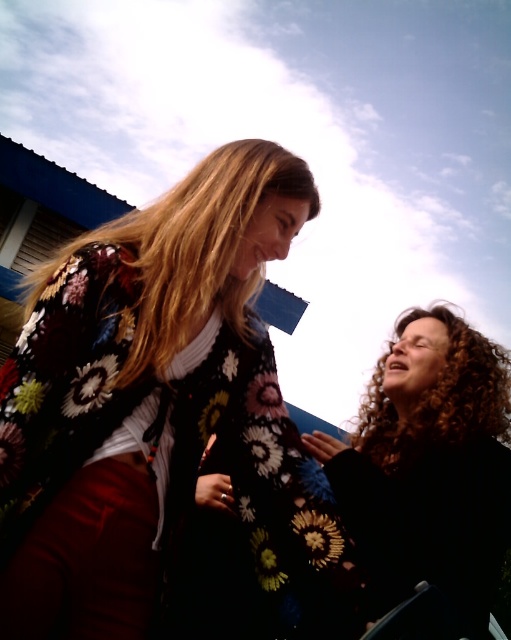
Question: Which point is closer to the camera?

Choices:
 (A) (501, 376)
 (B) (123, 483)
 (C) (180, 259)
 (D) (430, 356)

Answer: (B)

Question: In this image, where is black curly hair at right located relative to curly brown hair at lower right?

Choices:
 (A) right
 (B) left

Answer: (B)

Question: Is floral-patterned sweater at center smaller than curly brown hair at lower right?

Choices:
 (A) yes
 (B) no

Answer: (B)

Question: Which point is farther to the camera?

Choices:
 (A) (101, 230)
 (B) (446, 308)
 (C) (328, 541)
 (D) (407, 460)

Answer: (B)

Question: Is floral-patterned sweater at center to the right of blonde silky hair at upper center from the viewer's perspective?

Choices:
 (A) yes
 (B) no

Answer: (A)

Question: Which point appears closest to the camera in this image?

Choices:
 (A) (294, 531)
 (B) (492, 397)
 (C) (391, 412)

Answer: (A)